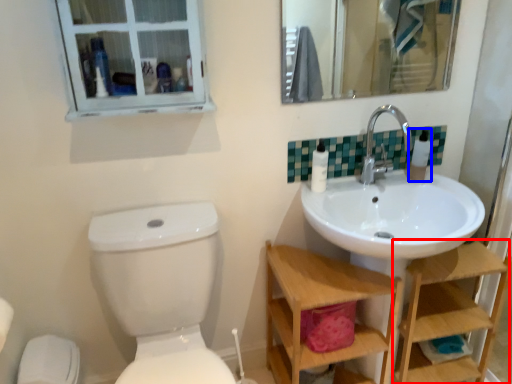
Question: Which object appears farthest to the camera in this image, shelf (highlighted by a red box) or toiletry (highlighted by a blue box)?

Choices:
 (A) shelf
 (B) toiletry

Answer: (B)